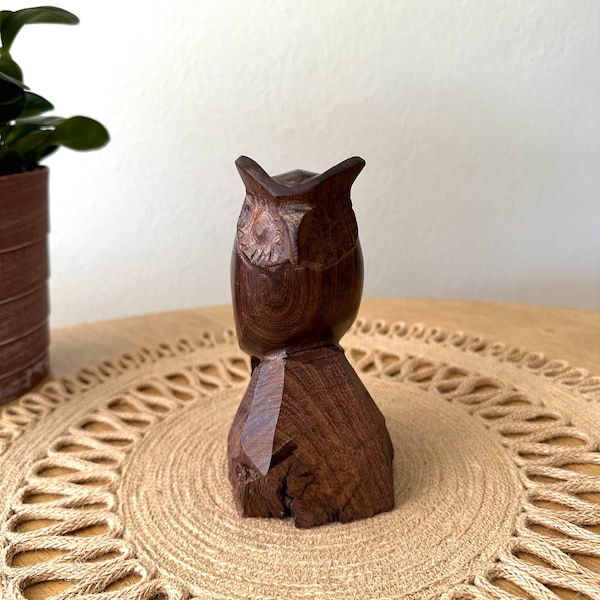
You are a GUI agent. You are given a task and a screenshot of the screen. Output one action in this format:
    pyautogui.click(x=<x>, y=<y>)
    Task: Click on the table
    This screenshot has height=600, width=600.
    Given the screenshot: What is the action you would take?
    pyautogui.click(x=577, y=350)